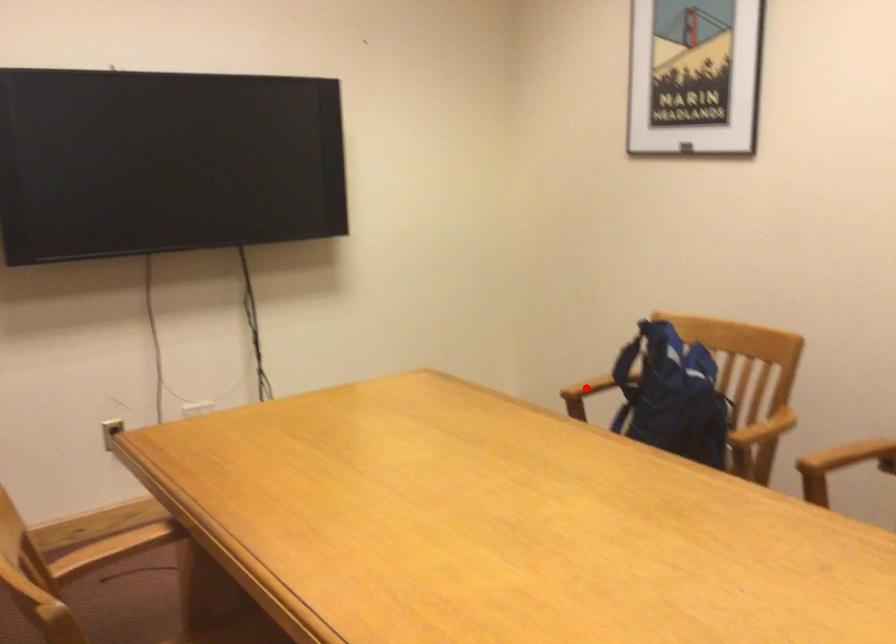
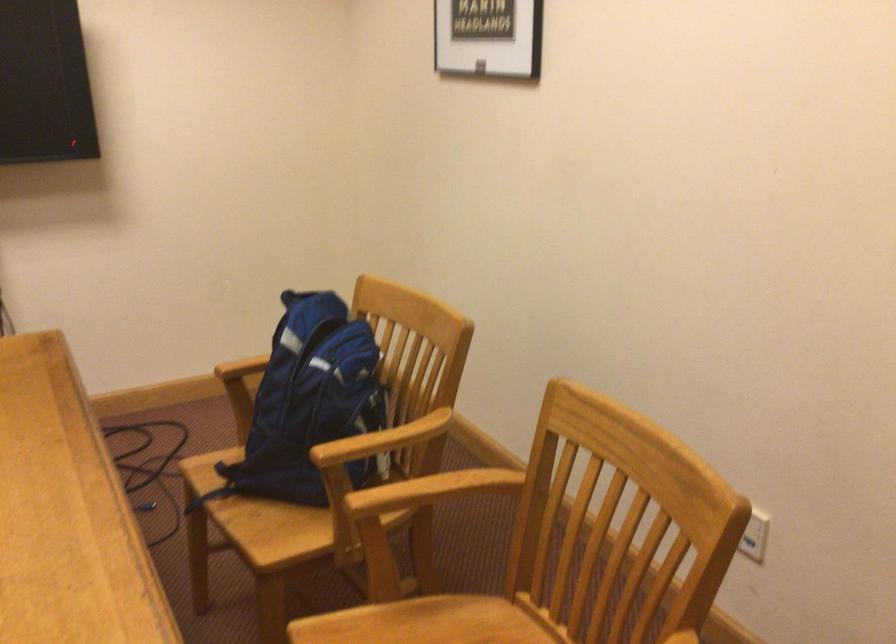
Question: I am providing you with two images of the same scene from different viewpoints. A red point is marked on the first image. Is the red point's position out of view in image 2?

Choices:
 (A) Yes
 (B) No

Answer: (A)